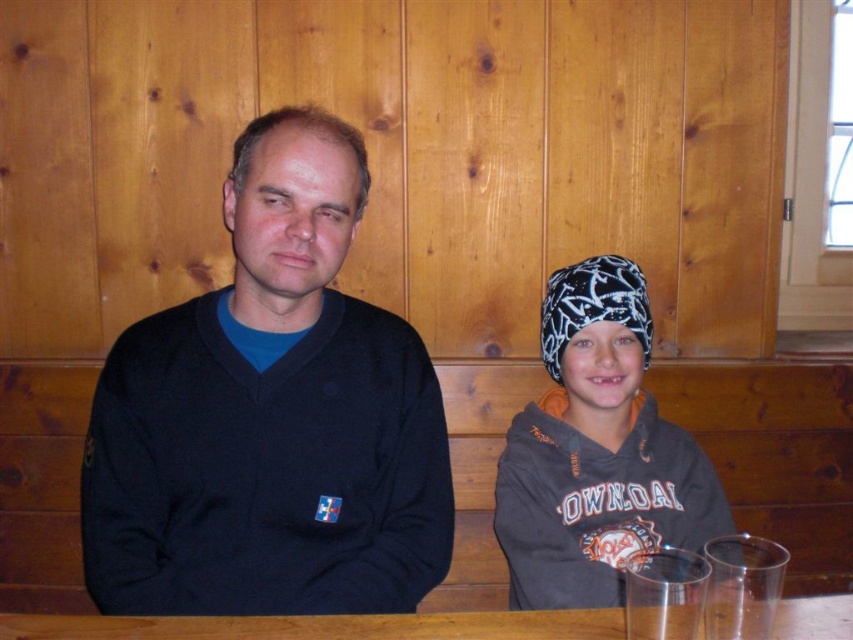
Question: Does dark gray hoodie at center lie in front of wooden table at center?

Choices:
 (A) yes
 (B) no

Answer: (B)

Question: Which point is farther from the camera taking this photo?

Choices:
 (A) (572, 563)
 (B) (379, 490)

Answer: (A)

Question: Is black matte sweater at center below wooden table at center?

Choices:
 (A) no
 (B) yes

Answer: (A)

Question: Which of the following is the farthest from the observer?

Choices:
 (A) tap(318, 557)
 (B) tap(816, 602)
 (C) tap(637, 371)

Answer: (C)

Question: Is dark gray hoodie at center positioned in front of wooden table at center?

Choices:
 (A) yes
 (B) no

Answer: (B)

Question: Which is nearer to the black matte sweater at center?

Choices:
 (A) wooden table at center
 (B) dark gray hoodie at center

Answer: (A)